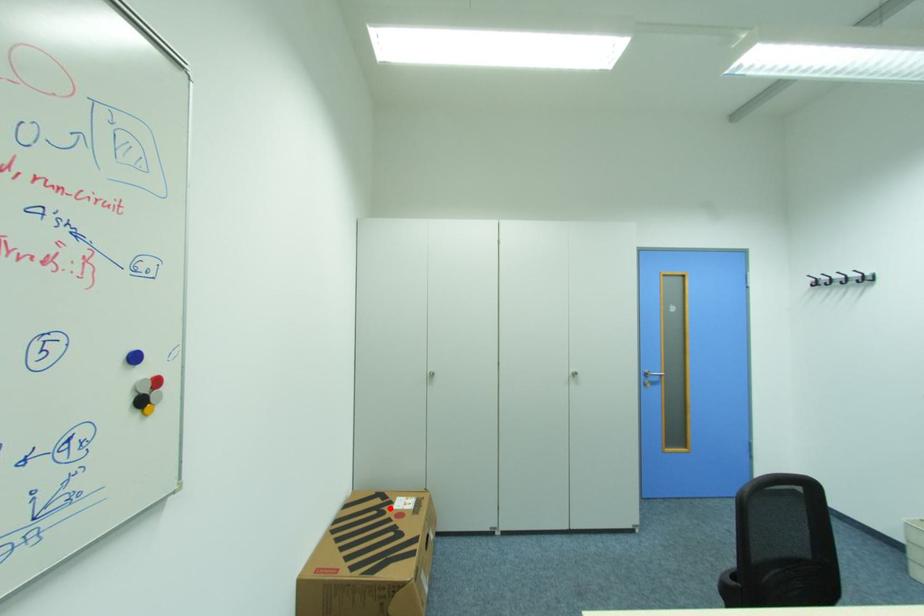
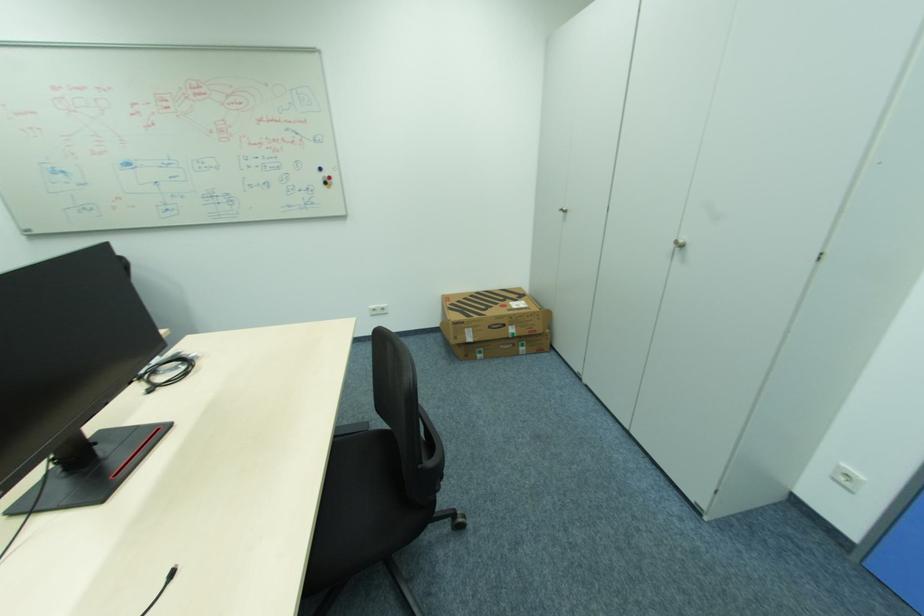
Locate, in the second image, the point that corresponds to the highlighted location in the first image.

(513, 300)